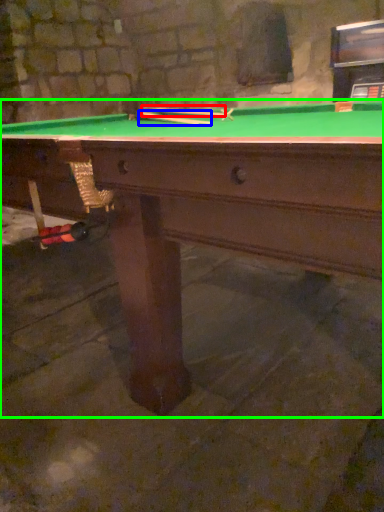
Question: Which object is positioned farthest from cue (highlighted by a red box)? Select from cue (highlighted by a blue box) and billiard table (highlighted by a green box).

Choices:
 (A) cue
 (B) billiard table

Answer: (B)